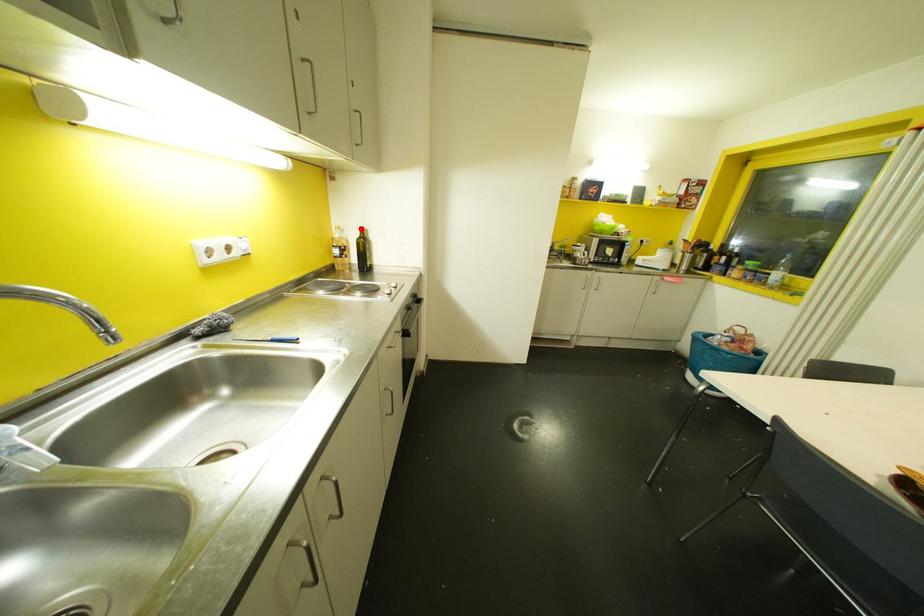
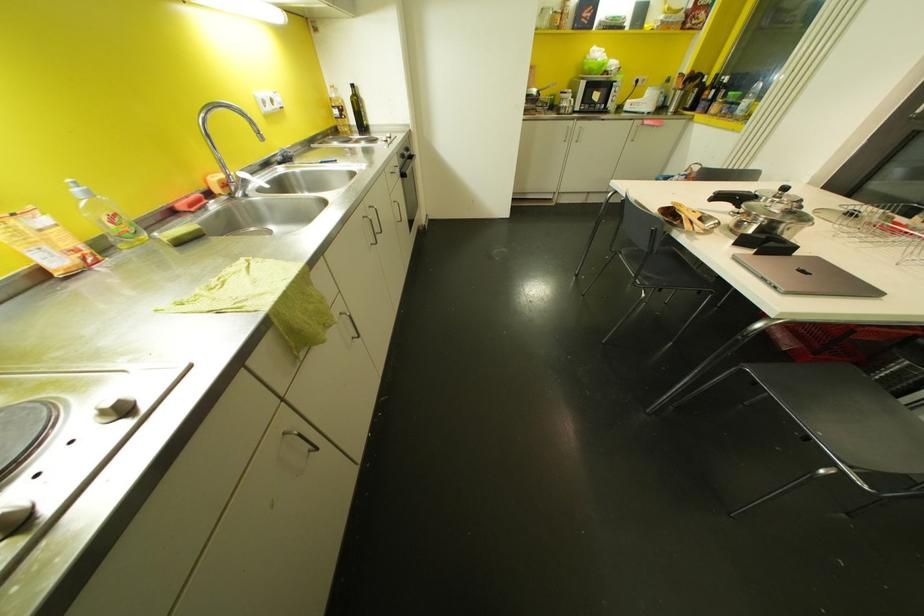
Question: I am providing you with two images of the same scene from different viewpoints. A red point is marked on the first image. Is the red point's position out of view in image 2?

Choices:
 (A) Yes
 (B) No

Answer: (B)